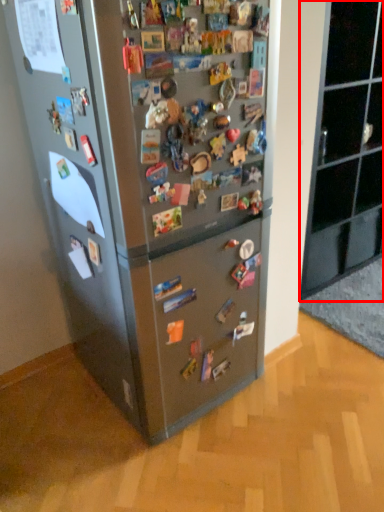
Question: From the image's perspective, what is the correct spatial relationship of cabinetry (annotated by the red box) in relation to refrigerator?

Choices:
 (A) below
 (B) above

Answer: (B)